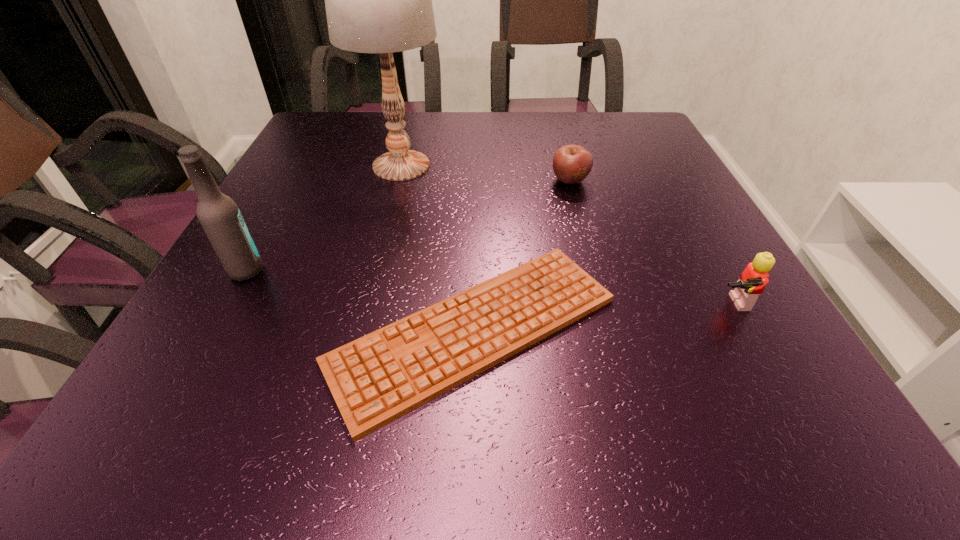
At what (x,y) coordinates should I click in order to perform the action: click on the tallest object. Please return your answer as a coordinate pair (x, y). This screenshot has height=540, width=960. Looking at the image, I should click on (378, 0).

Find the location of a particular element. Image resolution: width=960 pixels, height=540 pixels. the fourth shortest object is located at coordinates (220, 217).

The width and height of the screenshot is (960, 540). I want to click on beer bottle, so click(x=220, y=217).

Locate an element on the screen. This screenshot has height=540, width=960. the third shortest object is located at coordinates (752, 281).

This screenshot has width=960, height=540. Identify the location of the rightmost object. (752, 281).

I want to click on the fourth tallest object, so click(x=572, y=163).

Locate an element on the screen. the shortest object is located at coordinates (380, 377).

Locate an element on the screen. The image size is (960, 540). free space located 0.190m on the back of the lamp is located at coordinates (414, 114).

Locate an element on the screen. The height and width of the screenshot is (540, 960). vacant region located 0.240m on the side of the second tallest object with the label is located at coordinates (x=392, y=271).

Identify the location of free spot located in front of the rightmost object with the accessory visible. (795, 424).